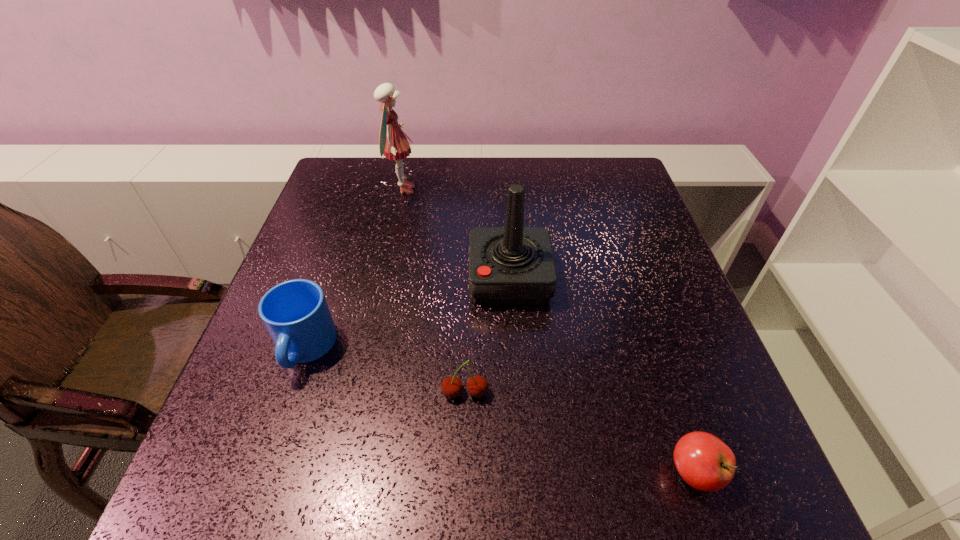
Identify the location of the farthest object. The height and width of the screenshot is (540, 960). (393, 144).

Where is `the tallest object`? The height and width of the screenshot is (540, 960). the tallest object is located at coordinates (393, 144).

Identify the location of joystick. (513, 265).

You are a GUI agent. You are given a task and a screenshot of the screen. Output one action in this format:
    pyautogui.click(x=<x>, y=<y>)
    Task: Click on the fourth nearest object
    Image resolution: width=960 pixels, height=540 pixels.
    Given the screenshot: What is the action you would take?
    pyautogui.click(x=513, y=265)

The width and height of the screenshot is (960, 540). What are the coordinates of `the leftmost object` in the screenshot? It's located at (295, 313).

You are a GUI agent. You are given a task and a screenshot of the screen. Output one action in this format:
    pyautogui.click(x=<x>, y=<y>)
    Task: Click on the cherry
    The height and width of the screenshot is (540, 960).
    Given the screenshot: What is the action you would take?
    pyautogui.click(x=477, y=386)

Where is `the nearest object`? This screenshot has width=960, height=540. the nearest object is located at coordinates (705, 462).

The width and height of the screenshot is (960, 540). Find the location of `apple`. apple is located at coordinates pos(705,462).

This screenshot has width=960, height=540. I want to click on vacant space situated on the front-facing side of the tallest object, so click(x=495, y=190).

What are the coordinates of `vacant position located on the front-facing side of the fourth nearest object` in the screenshot? It's located at (338, 279).